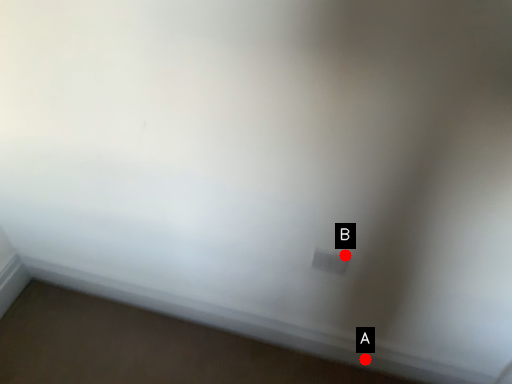
Question: Two points are circled on the image, labeled by A and B beside each circle. Which point is further to the camera?

Choices:
 (A) A is further
 (B) B is further

Answer: (A)